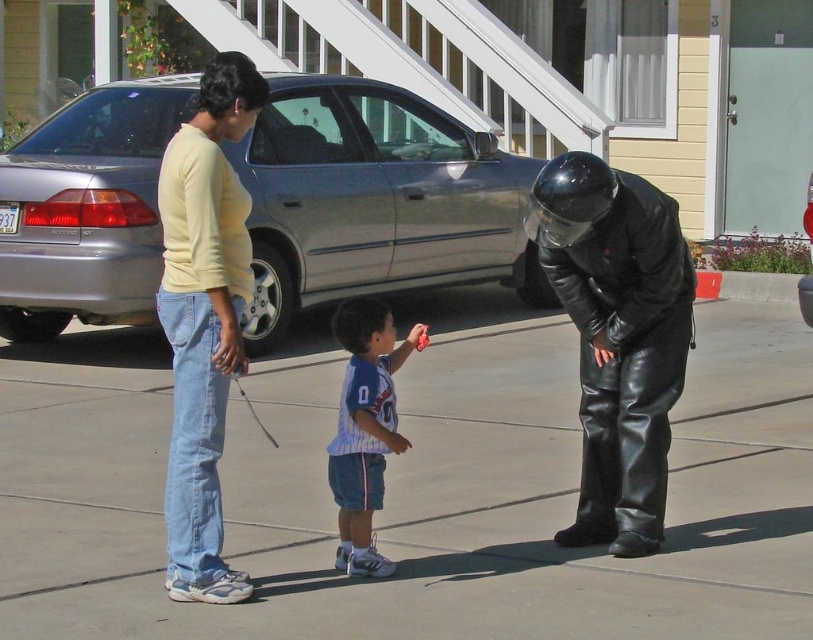
Is point (322, 524) more distant than point (44, 138)?

No, (322, 524) is closer to viewer.

Does point (725, 570) lie in front of point (515, 195)?

Yes.

In order to click on smooth concrete sidewalk at center in this screenshot , I will do `click(415, 496)`.

Between black leather helmet at center and white striped jersey at center, which one is positioned higher?

black leather helmet at center

Image resolution: width=813 pixels, height=640 pixels. What do you see at coordinates (618, 337) in the screenshot? I see `black leather helmet at center` at bounding box center [618, 337].

Identify the location of black leather helmet at center. The width and height of the screenshot is (813, 640). (618, 337).

Does smooth concrete sidewalk at center have a lesser width compared to white striped jersey at center?

No.

Is smooth concrete sidewalk at center shorter than white striped jersey at center?

Correct, smooth concrete sidewalk at center is not as tall as white striped jersey at center.

Find the location of `smooth concrete sidewalk at center`. smooth concrete sidewalk at center is located at coordinates (415, 496).

Find the location of a particular element. Image resolution: width=813 pixels, height=640 pixels. smooth concrete sidewalk at center is located at coordinates (415, 496).